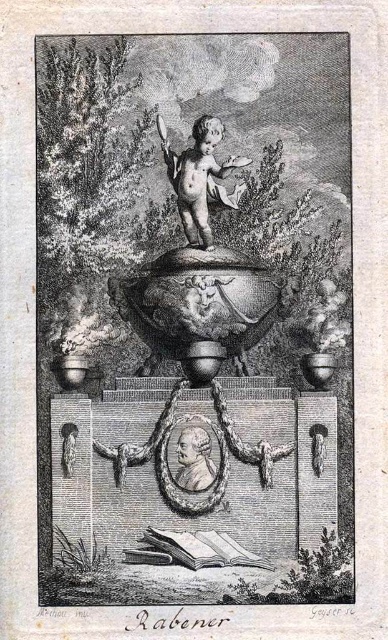
This screenshot has height=640, width=388. I want to click on etched bronze urn at center, so click(x=194, y=317).

Is etched bronze urn at center wider than smooth bronze cherub at center?

Yes, etched bronze urn at center is wider than smooth bronze cherub at center.

Who is more forward, (342, 584) or (228, 205)?

Point (342, 584) is more forward.

This screenshot has width=388, height=640. What are the coordinates of `etched bronze urn at center` in the screenshot? It's located at (194, 317).